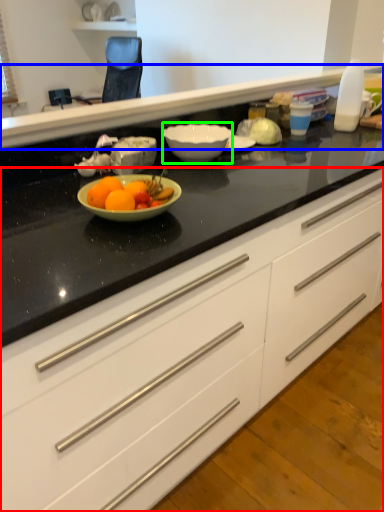
Question: Considering the real-world distances, which object is closest to cabinetry (highlighted by a red box)? counter top (highlighted by a blue box) or bowl (highlighted by a green box).

Choices:
 (A) counter top
 (B) bowl

Answer: (B)